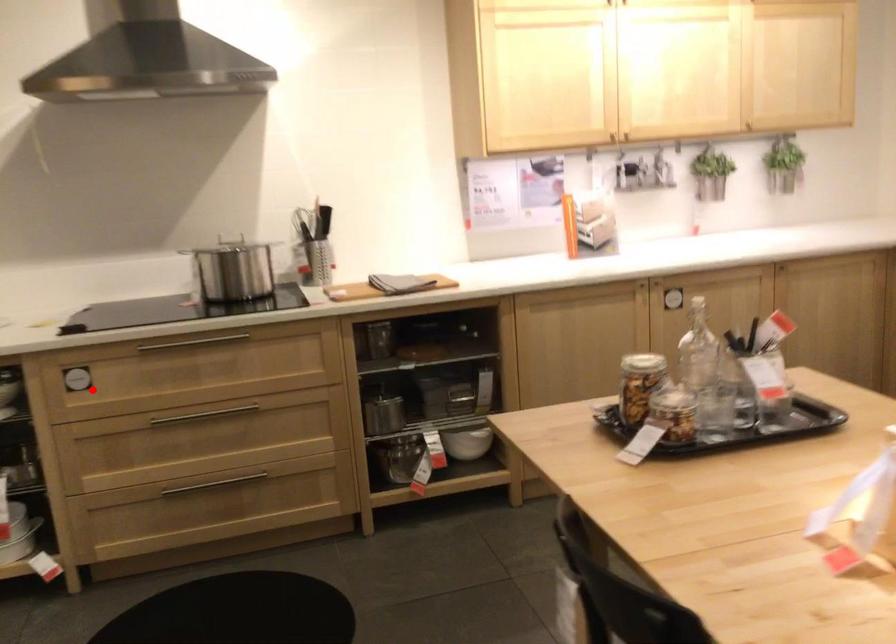
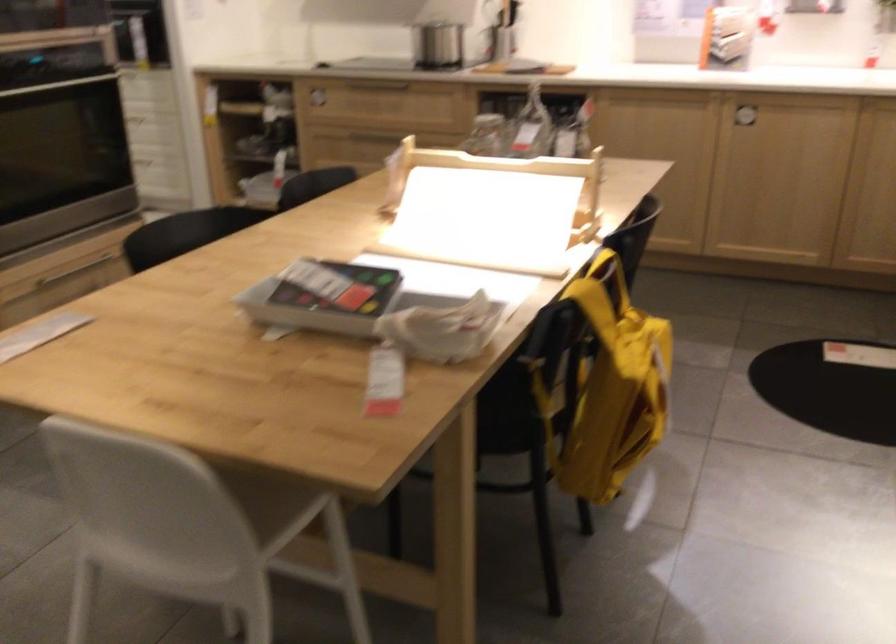
Where in the second image is the point corresponding to the highlighted location from the first image?

(316, 100)